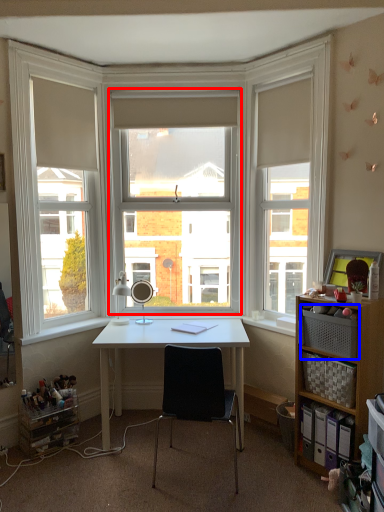
Question: Which object is closer to the camera taking this photo, window (highlighted by a red box) or drawer (highlighted by a blue box)?

Choices:
 (A) window
 (B) drawer

Answer: (B)